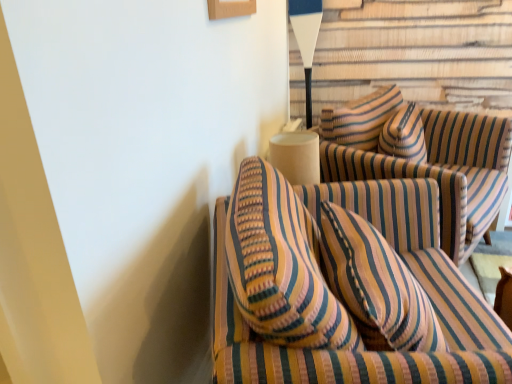
Question: Which direction should I rotate to face striped fabric couch at center, the second studio couch viewed from the front, — up or down?

Choices:
 (A) down
 (B) up

Answer: (B)

Question: Can you confirm if striped fabric couch at center, the first studio couch viewed from the back, is shorter than striped fabric couch at center, placed as the 2th studio couch when sorted from back to front?

Choices:
 (A) yes
 (B) no

Answer: (A)

Question: Can you confirm if striped fabric couch at center, the first studio couch viewed from the back, is thinner than striped fabric couch at center, which is the 1th studio couch in front-to-back order?

Choices:
 (A) no
 (B) yes

Answer: (B)

Question: Is striped fabric couch at center, the second studio couch viewed from the front, wider than striped fabric couch at center, which is the 1th studio couch in front-to-back order?

Choices:
 (A) no
 (B) yes

Answer: (A)

Question: Can you confirm if striped fabric couch at center, the second studio couch viewed from the front, is bigger than striped fabric couch at center, which is the 1th studio couch in front-to-back order?

Choices:
 (A) no
 (B) yes

Answer: (A)

Question: Is striped fabric couch at center, the second studio couch viewed from the front, completely or partially outside of striped fabric couch at center, which is the 1th studio couch in front-to-back order?

Choices:
 (A) no
 (B) yes

Answer: (B)

Question: Does striped fabric couch at center, the second studio couch viewed from the front, appear on the right side of striped fabric couch at center, placed as the 2th studio couch when sorted from back to front?

Choices:
 (A) yes
 (B) no

Answer: (A)

Question: Can you confirm if striped fabric couch at center, the second studio couch viewed from the front, is positioned to the right of white matte table lamp at upper center?

Choices:
 (A) yes
 (B) no

Answer: (A)

Question: Does striped fabric couch at center, the second studio couch viewed from the front, touch white matte table lamp at upper center?

Choices:
 (A) no
 (B) yes

Answer: (A)

Question: Is striped fabric couch at center, the first studio couch viewed from the back, further to the viewer compared to white matte table lamp at upper center?

Choices:
 (A) yes
 (B) no

Answer: (B)

Question: Can you confirm if striped fabric couch at center, the first studio couch viewed from the back, is thinner than white matte table lamp at upper center?

Choices:
 (A) no
 (B) yes

Answer: (A)

Question: Is striped fabric couch at center, the second studio couch viewed from the front, not close to white matte table lamp at upper center?

Choices:
 (A) yes
 (B) no

Answer: (B)

Question: Does striped fabric couch at center, the second studio couch viewed from the front, have a greater width compared to white matte table lamp at upper center?

Choices:
 (A) no
 (B) yes

Answer: (B)

Question: Considering the relative sizes of striped fabric couch at center, which is the 1th studio couch in front-to-back order, and striped fabric couch at center, the second studio couch viewed from the front, in the image provided, is striped fabric couch at center, which is the 1th studio couch in front-to-back order, shorter than striped fabric couch at center, the second studio couch viewed from the front,?

Choices:
 (A) no
 (B) yes

Answer: (A)